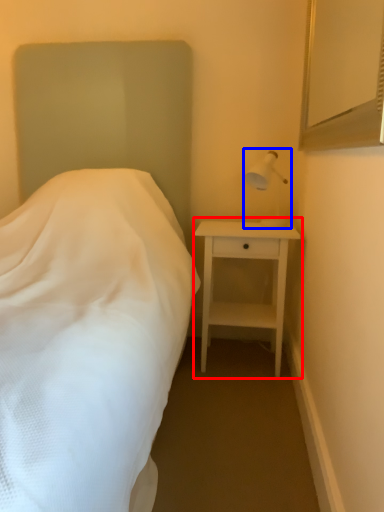
Question: Which point is further to the camera, nightstand (highlighted by a red box) or bedside lamp (highlighted by a blue box)?

Choices:
 (A) nightstand
 (B) bedside lamp

Answer: (A)